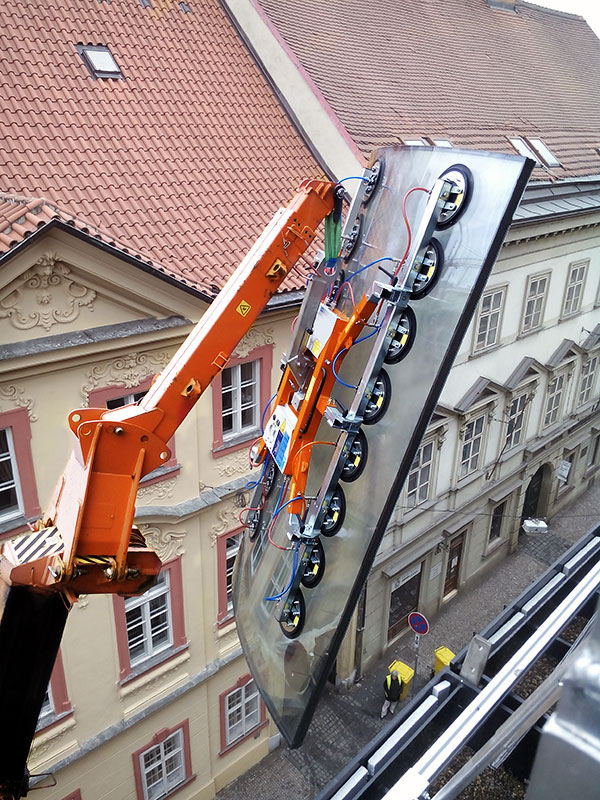
This screenshot has height=800, width=600. Identify the location of window. (173, 772).